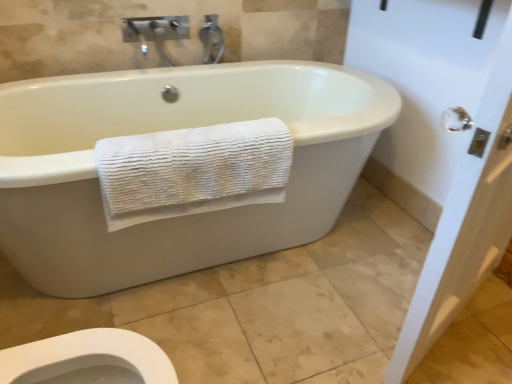
Question: Is white glossy door handle at upper right facing towards white textured towel at lower left?

Choices:
 (A) yes
 (B) no

Answer: (B)

Question: Is white glossy door handle at upper right looking in the opposite direction of white textured towel at lower left?

Choices:
 (A) no
 (B) yes

Answer: (B)

Question: From a real-world perspective, is white glossy door handle at upper right beneath white textured towel at lower left?

Choices:
 (A) yes
 (B) no

Answer: (B)

Question: Does white glossy door handle at upper right have a lesser height compared to white textured towel at lower left?

Choices:
 (A) yes
 (B) no

Answer: (B)

Question: Is white glossy door handle at upper right thinner than white textured towel at lower left?

Choices:
 (A) no
 (B) yes

Answer: (B)

Question: Does white glossy door handle at upper right have a greater width compared to white textured towel at lower left?

Choices:
 (A) yes
 (B) no

Answer: (B)

Question: Is white textured towel at lower left to the left of white glossy door handle at upper right from the viewer's perspective?

Choices:
 (A) yes
 (B) no

Answer: (A)

Question: Is white textured towel at lower left bigger than white glossy door handle at upper right?

Choices:
 (A) no
 (B) yes

Answer: (A)

Question: Does white textured towel at lower left appear on the right side of white glossy door handle at upper right?

Choices:
 (A) yes
 (B) no

Answer: (B)

Question: Is white textured towel at lower left thinner than white glossy door handle at upper right?

Choices:
 (A) yes
 (B) no

Answer: (B)

Question: Is white textured towel at lower left far from white glossy door handle at upper right?

Choices:
 (A) yes
 (B) no

Answer: (A)

Question: Considering the relative sizes of white textured towel at lower left and white glossy door handle at upper right in the image provided, is white textured towel at lower left smaller than white glossy door handle at upper right?

Choices:
 (A) yes
 (B) no

Answer: (A)

Question: Relative to white glossy door handle at upper right, is white textured towel at lower left in front or behind?

Choices:
 (A) behind
 (B) front

Answer: (A)